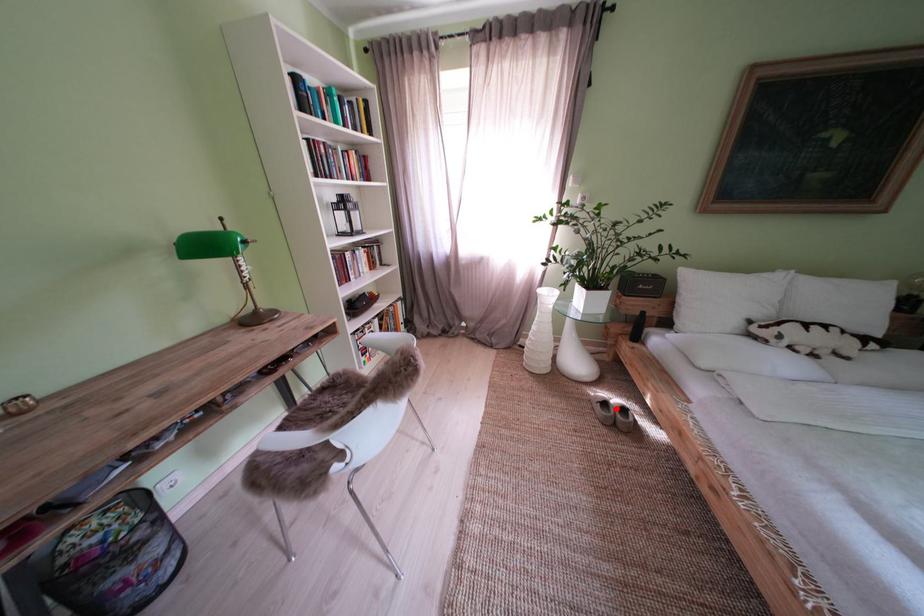
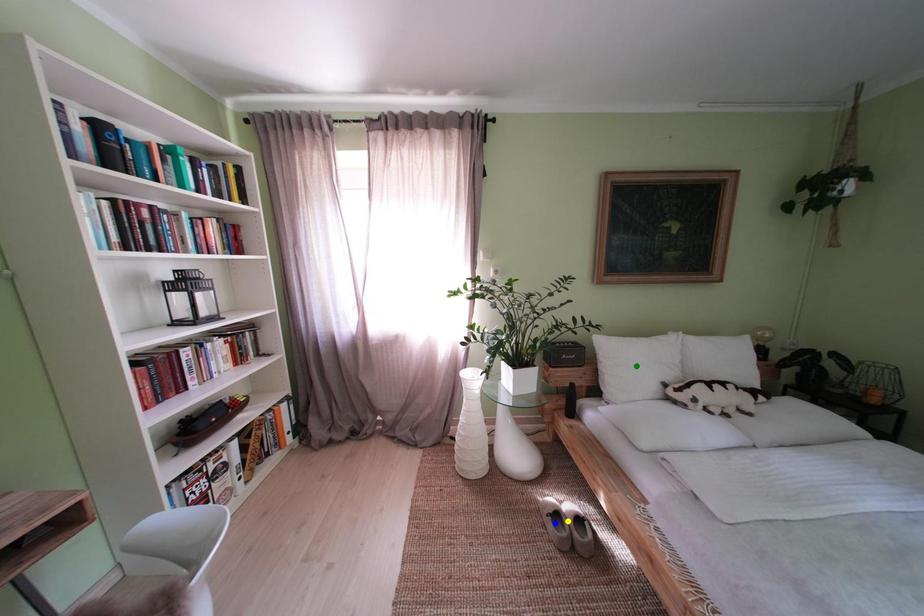
Question: I am providing you with two images of the same scene from different viewpoints. A red point is marked on the first image. You are given multiple points on the second image. Which point in image 2 represents the same 3d spot as the red point in image 1?

Choices:
 (A) blue point
 (B) yellow point
 (C) green point

Answer: (B)